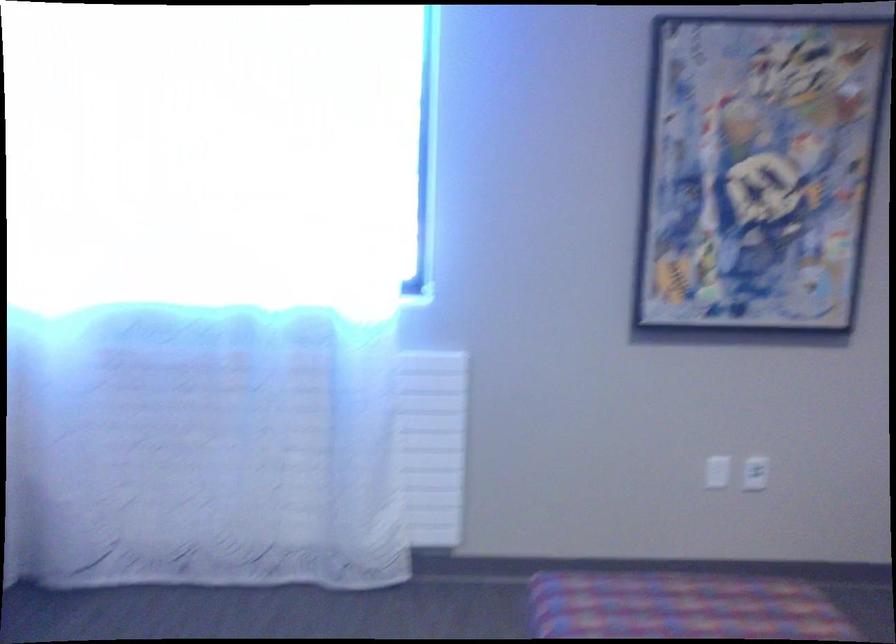
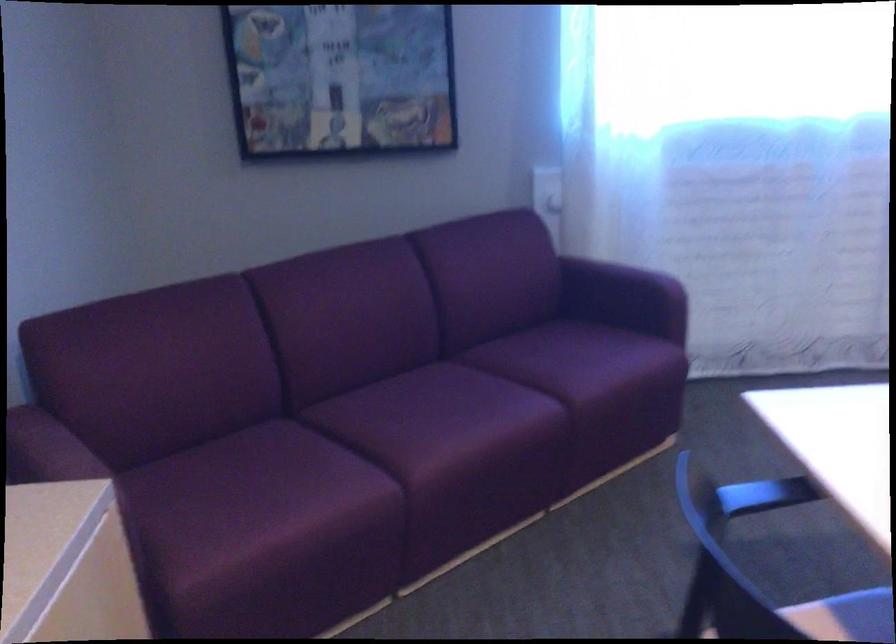
Question: In a continuous first-person perspective shot, in which direction is the camera moving?

Choices:
 (A) Left
 (B) Right
 (C) Forward
 (D) Backward

Answer: (A)